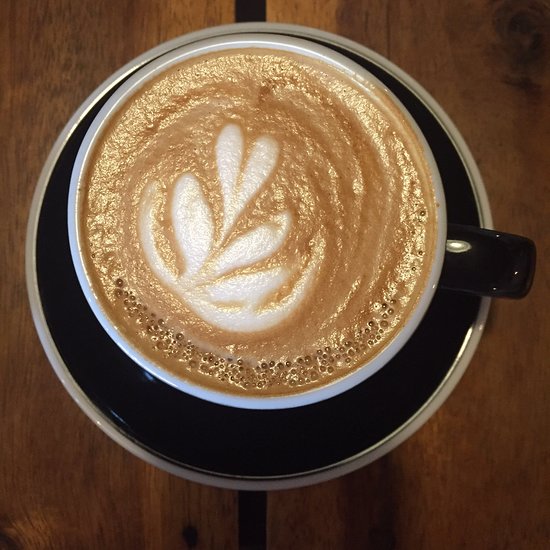
Image resolution: width=550 pixels, height=550 pixels. What are the coordinates of `dark circle on table` in the screenshot? It's located at (189, 530).